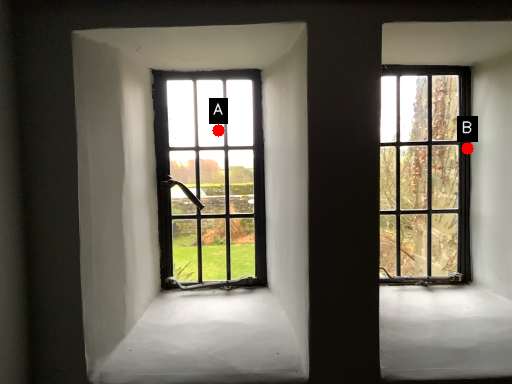
Question: Two points are circled on the image, labeled by A and B beside each circle. Which point is farther to the camera?

Choices:
 (A) A is further
 (B) B is further

Answer: (A)